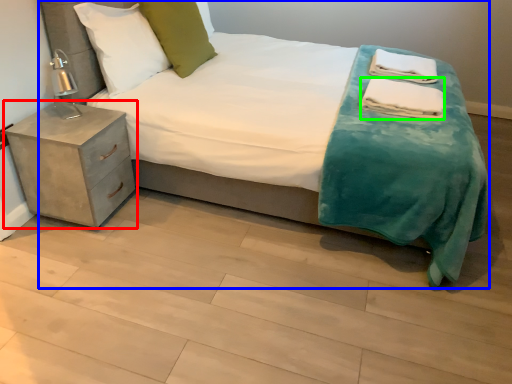
Question: Which object is positioned farthest from nightstand (highlighted by a red box)? Select from bed (highlighted by a blue box) and material (highlighted by a green box).

Choices:
 (A) bed
 (B) material

Answer: (B)